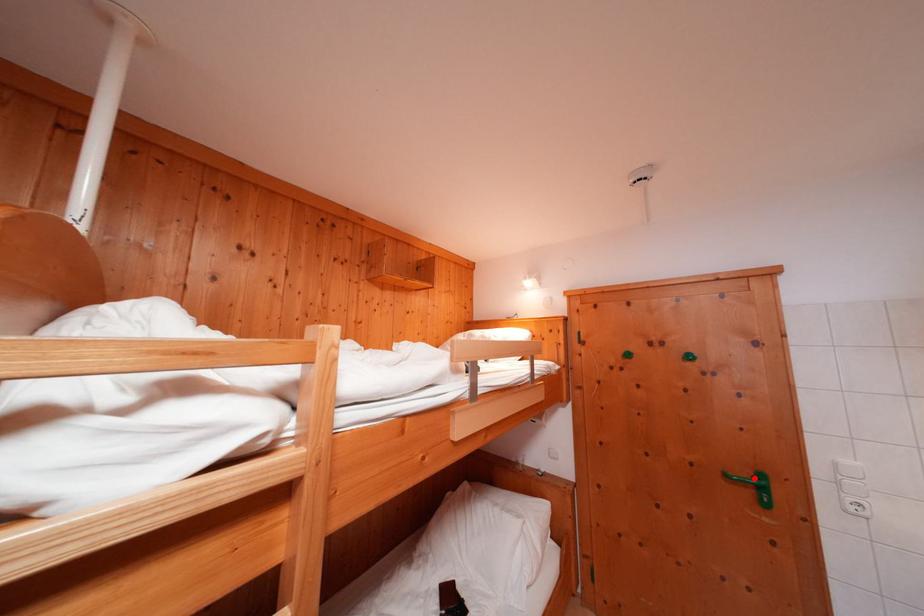
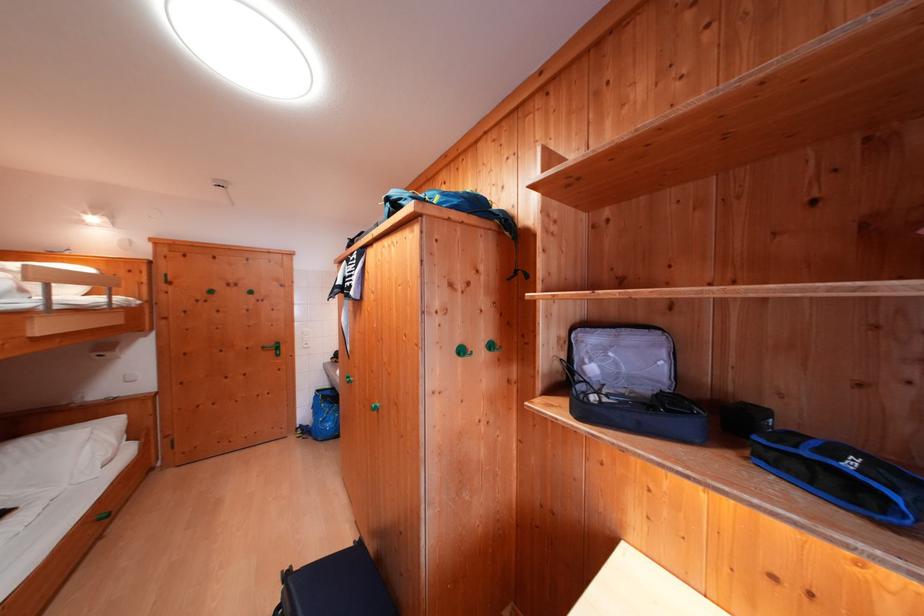
Question: I am providing you with two images of the same scene from different viewpoints. Given a red point in image1, look at the same physical point in image2. Is it:

Choices:
 (A) Closer to the viewpoint
 (B) Farther from the viewpoint

Answer: (B)